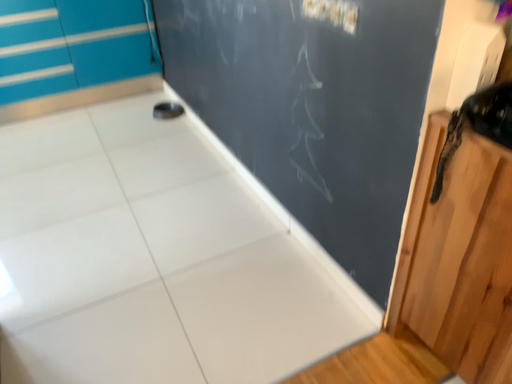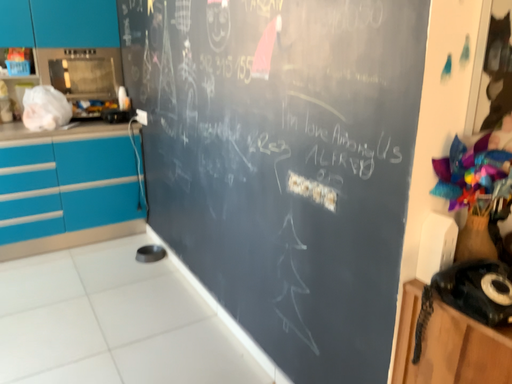
Question: How did the camera likely rotate when shooting the video?

Choices:
 (A) rotated upward
 (B) rotated downward

Answer: (A)